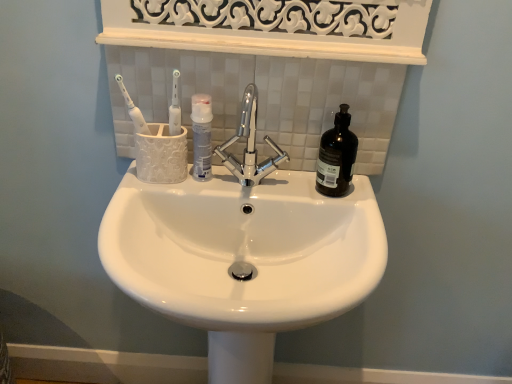
Question: Is white matte mouthwash at center, acting as the 2th mouthwash starting from the right, not close to white glossy toothbrush at upper left?

Choices:
 (A) no
 (B) yes

Answer: (A)

Question: From the image's perspective, is white matte mouthwash at center, which is the first mouthwash in left-to-right order, on white glossy toothbrush at upper left?

Choices:
 (A) yes
 (B) no

Answer: (B)

Question: Does white matte mouthwash at center, acting as the 2th mouthwash starting from the right, have a larger size compared to white glossy toothbrush at upper left?

Choices:
 (A) no
 (B) yes

Answer: (B)

Question: From a real-world perspective, is white matte mouthwash at center, which is the first mouthwash in left-to-right order, below white glossy toothbrush at upper left?

Choices:
 (A) yes
 (B) no

Answer: (A)

Question: Considering the relative sizes of white matte mouthwash at center, acting as the 2th mouthwash starting from the right, and white glossy toothbrush at upper left in the image provided, is white matte mouthwash at center, acting as the 2th mouthwash starting from the right, taller than white glossy toothbrush at upper left?

Choices:
 (A) yes
 (B) no

Answer: (B)

Question: Is white matte mouthwash at center, which is the first mouthwash in left-to-right order, thinner than white glossy toothbrush at upper left?

Choices:
 (A) no
 (B) yes

Answer: (A)

Question: Can you confirm if white glossy sink at center is shorter than black glass bottle at right, arranged as the second mouthwash when viewed from the left?

Choices:
 (A) no
 (B) yes

Answer: (A)

Question: Considering the relative sizes of white glossy sink at center and black glass bottle at right, arranged as the second mouthwash when viewed from the left, in the image provided, is white glossy sink at center taller than black glass bottle at right, arranged as the second mouthwash when viewed from the left,?

Choices:
 (A) no
 (B) yes

Answer: (B)

Question: Is white glossy sink at center positioned far away from black glass bottle at right, arranged as the second mouthwash when viewed from the left?

Choices:
 (A) no
 (B) yes

Answer: (A)

Question: From a real-world perspective, is white glossy sink at center on black glass bottle at right, arranged as the second mouthwash when viewed from the left?

Choices:
 (A) yes
 (B) no

Answer: (B)

Question: Is white glossy sink at center positioned behind black glass bottle at right, arranged as the second mouthwash when viewed from the left?

Choices:
 (A) yes
 (B) no

Answer: (B)

Question: Is white glossy sink at center to the right of black glass bottle at right, which ranks as the first mouthwash in right-to-left order, from the viewer's perspective?

Choices:
 (A) yes
 (B) no

Answer: (B)

Question: Is white glossy toothbrush at upper left not near white matte mouthwash at center, which is the first mouthwash in left-to-right order?

Choices:
 (A) no
 (B) yes

Answer: (A)